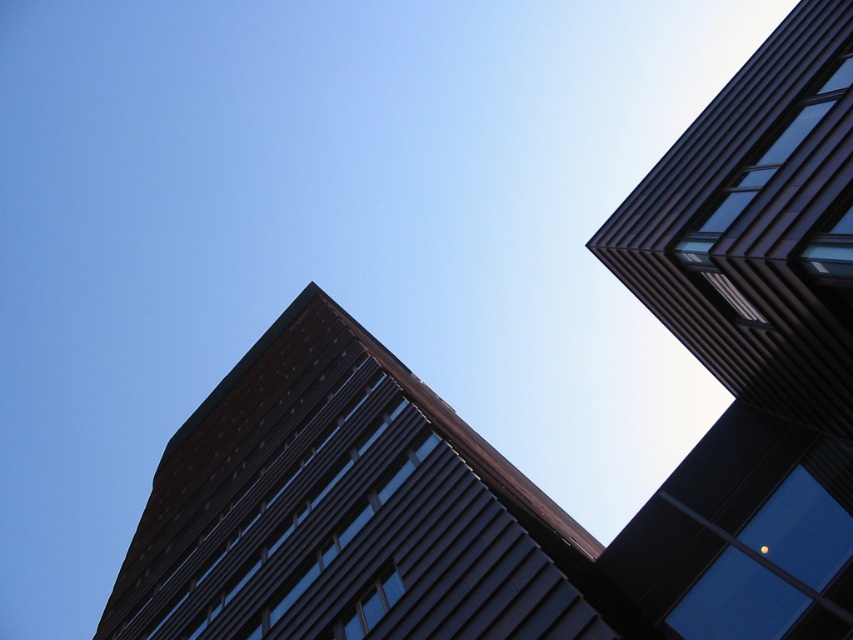
Can you confirm if metallic glass building at upper right is taller than dark brown glass building at center?

Yes.

Is metallic glass building at upper right positioned behind dark brown glass building at center?

That is True.

Based on the photo, who is more forward, (793, 324) or (459, 429)?

Positioned in front is point (793, 324).

Locate an element on the screen. This screenshot has height=640, width=853. metallic glass building at upper right is located at coordinates (753, 346).